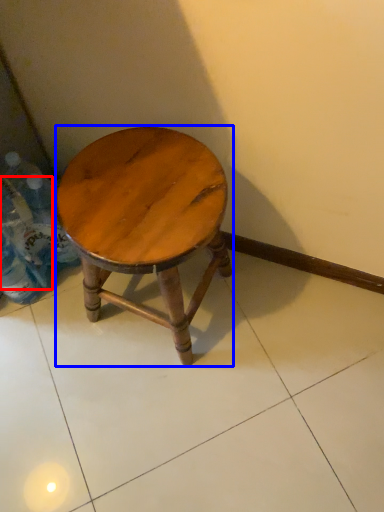
Question: Which of the following is the farthest to the observer, bottle (highlighted by a red box) or stool (highlighted by a blue box)?

Choices:
 (A) bottle
 (B) stool

Answer: (A)